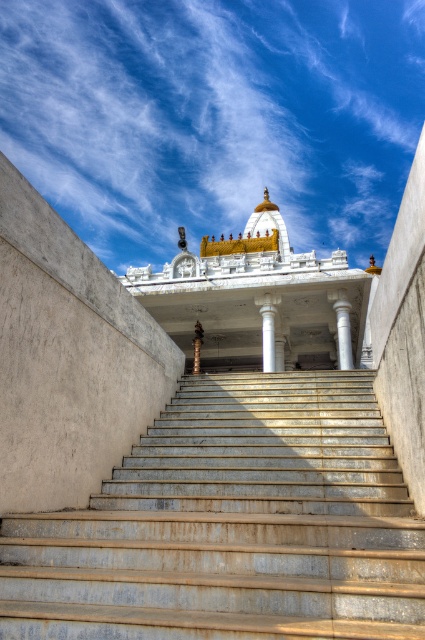
Between white marble pillar at center and white marble column at center, which one appears on the left side from the viewer's perspective?

From the viewer's perspective, white marble column at center appears more on the left side.

Image resolution: width=425 pixels, height=640 pixels. What do you see at coordinates (342, 326) in the screenshot?
I see `white marble pillar at center` at bounding box center [342, 326].

The image size is (425, 640). I want to click on white marble pillar at center, so click(342, 326).

Consider the image. Which of these two, rusty metal stairs at center or white marble column at center, stands taller?

white marble column at center is taller.

Does rusty metal stairs at center have a lesser width compared to white marble column at center?

No, rusty metal stairs at center is not thinner than white marble column at center.

What do you see at coordinates (232, 524) in the screenshot? I see `rusty metal stairs at center` at bounding box center [232, 524].

Find the location of a particular element. rusty metal stairs at center is located at coordinates (232, 524).

Which of these two, rusty metal stairs at center or white marble temple at center, stands shorter?

rusty metal stairs at center is shorter.

Which is more to the right, rusty metal stairs at center or white marble temple at center?

white marble temple at center is more to the right.

Is point (176, 563) positioned in front of point (362, 292)?

Yes, it is.

This screenshot has width=425, height=640. Find the location of `rusty metal stairs at center`. rusty metal stairs at center is located at coordinates (232, 524).